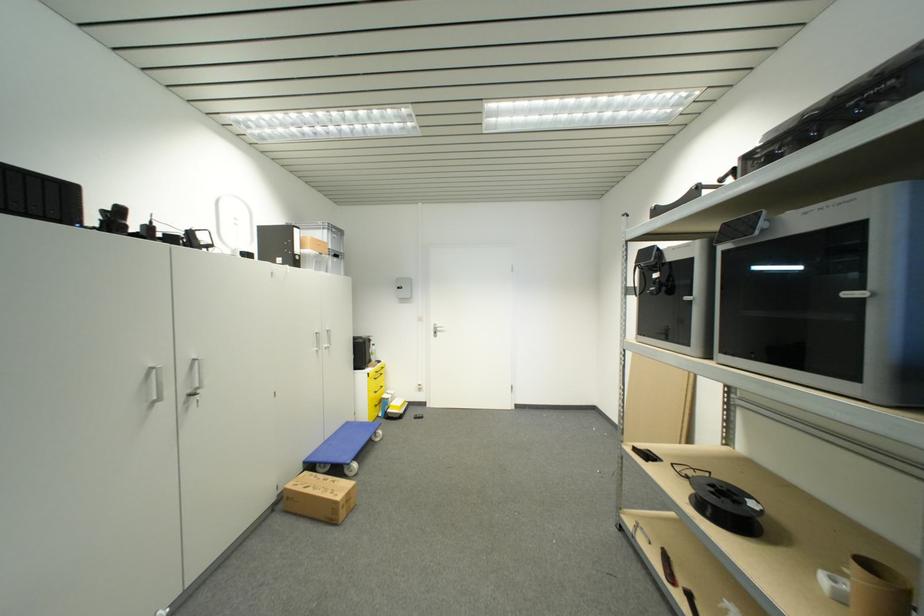
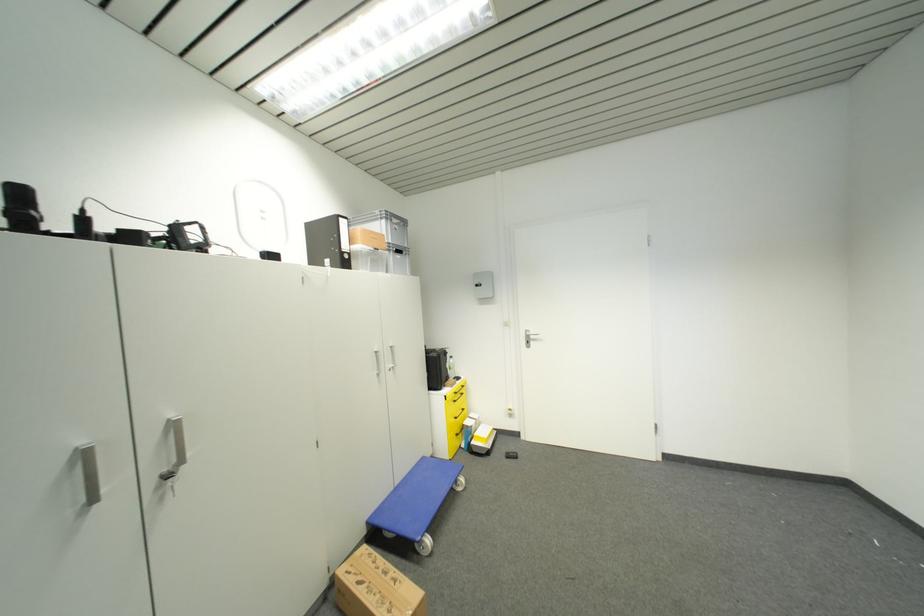
Question: Which direction would the cameraman need to move to produce the second image? Reply with the corresponding letter.

Choices:
 (A) Left
 (B) Right
 (C) Forward
 (D) Backward

Answer: (C)